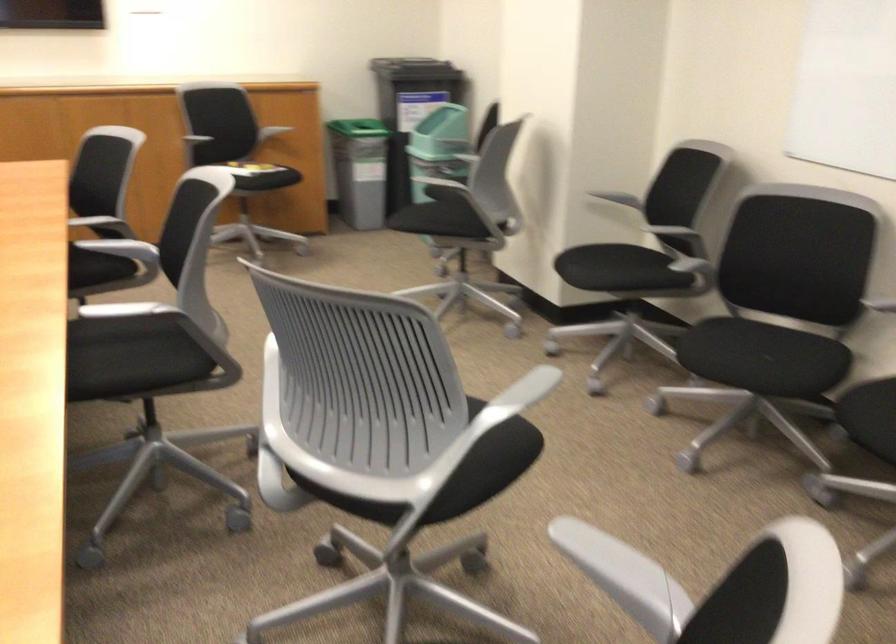
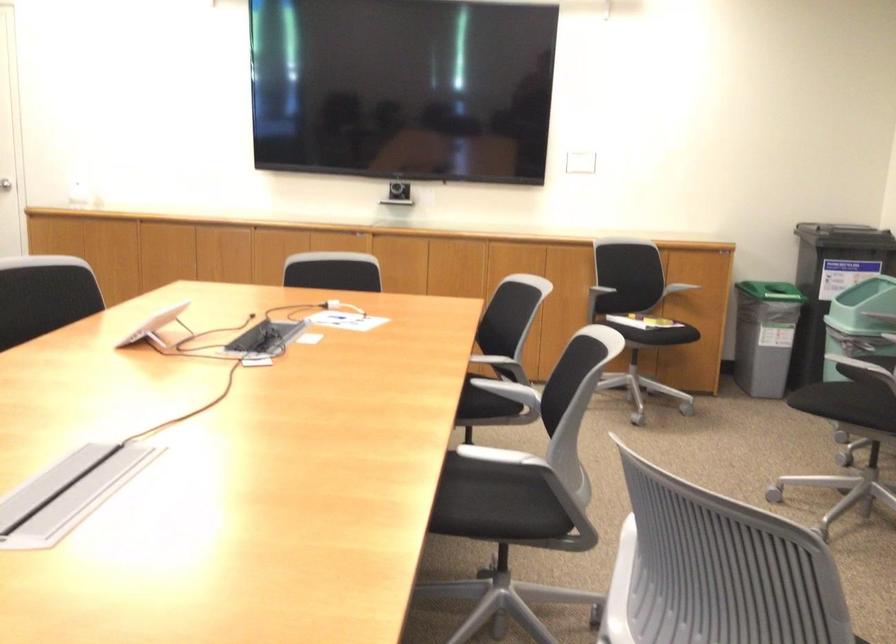
Locate, in the second image, the point that corresponds to point (135, 359) in the first image.

(492, 504)